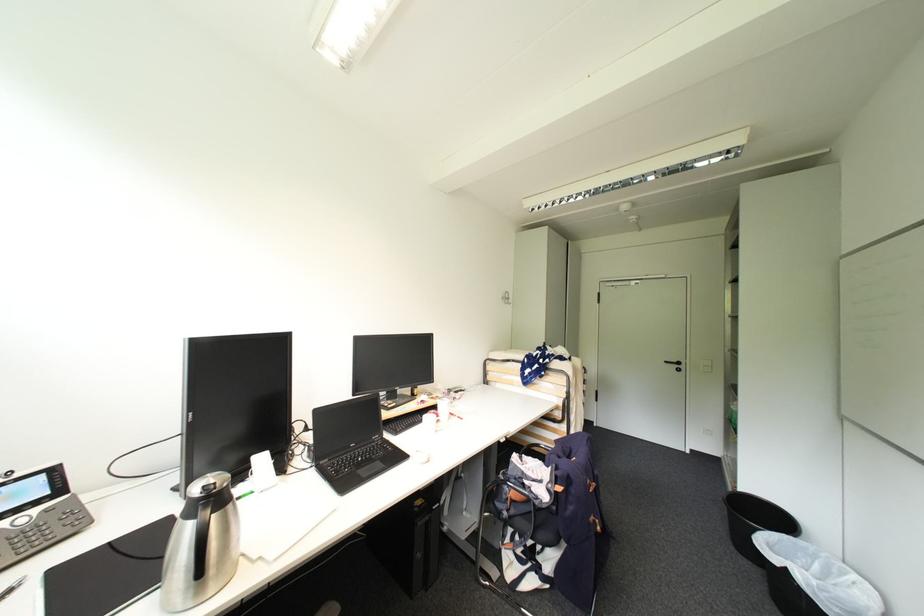
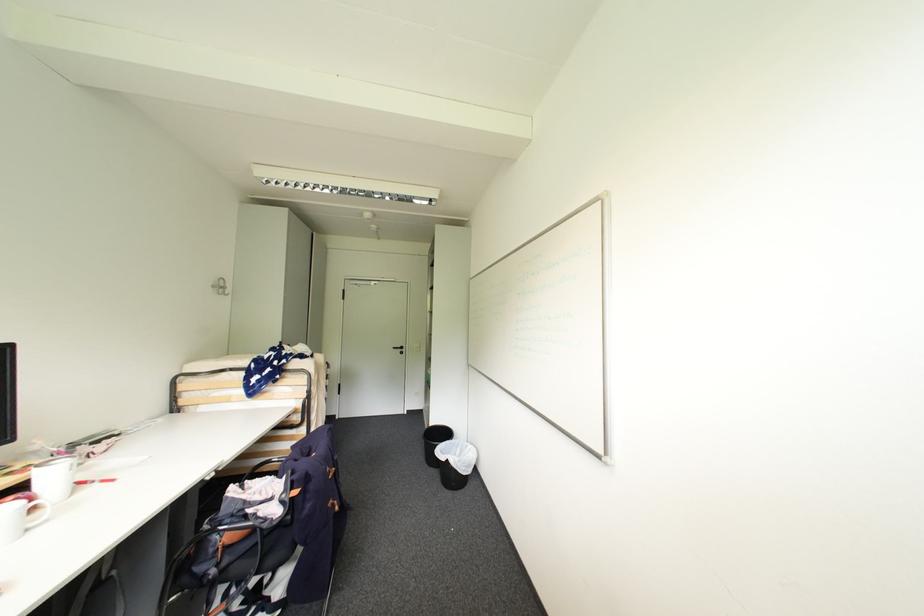
In the second image, find the point that corresponds to (x=673, y=363) in the first image.

(400, 349)